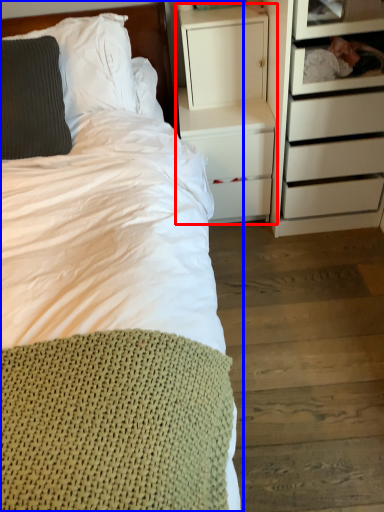
Question: Which of the following is the closest to the observer, nightstand (highlighted by a red box) or bed (highlighted by a blue box)?

Choices:
 (A) nightstand
 (B) bed

Answer: (B)